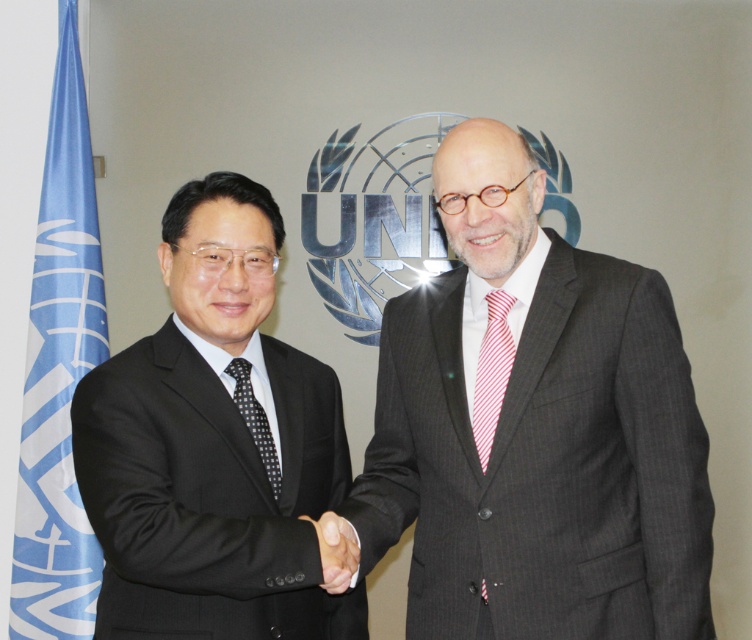
Looking at this image, you are a photographer at the UN event and need to adjust the lighting so that the gray pinstripe suit at center and the black matte suit at left are both well lit. Which suit should you focus on adjusting first if you want to ensure the one closer to the camera is properly illuminated?

The gray pinstripe suit at center is closer to the viewer than the black matte suit at left, so you should focus on adjusting the lighting for the gray pinstripe suit at center first to ensure it is properly illuminated.

Based on the photo, you are standing at the center of the image and want to move towards the gray pinstripe suit at center. In which direction should you move?

The gray pinstripe suit at center is located at point 0.673 on the x axis and 0.714 on the y axis. Since you are at the center, which is at point 0.5 on both axes, you should move towards the right and upwards to reach the gray pinstripe suit at center.

You are an observer at the United Nations ceremony. You notice the black matte hand at center and the black dotted tie at center. Which object is positioned lower in the image?

The black matte hand at center has a lesser height compared to the black dotted tie at center, so the black matte hand at center is positioned lower in the image.